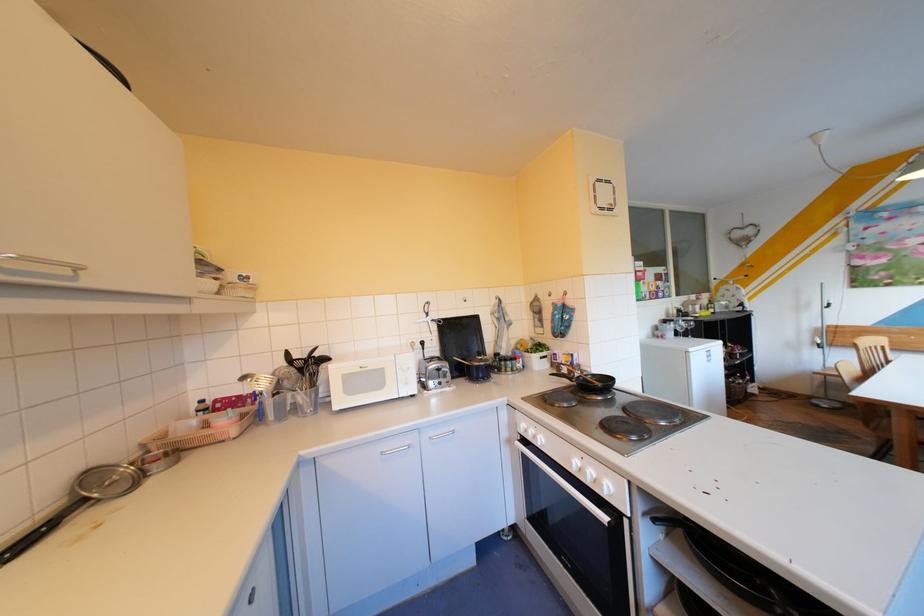
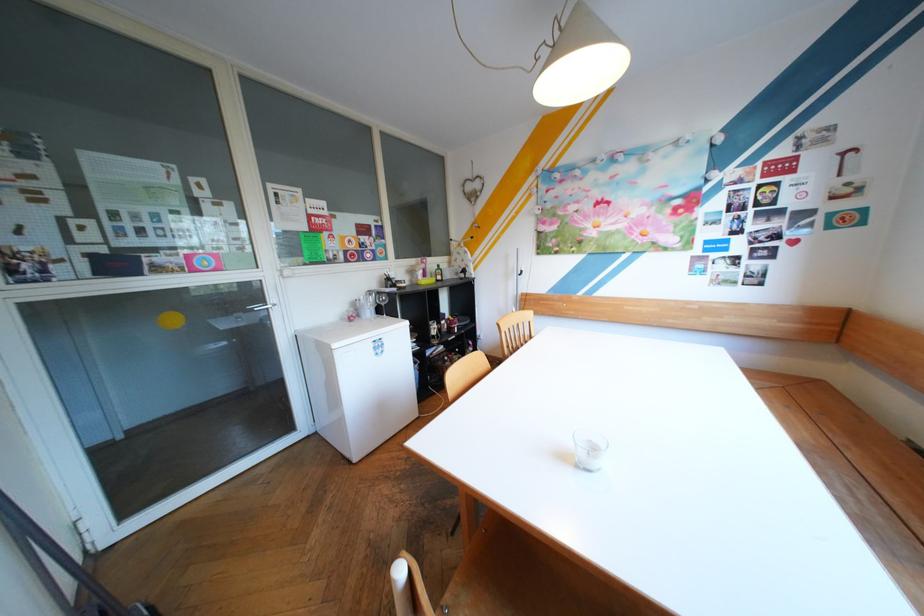
Locate, in the second image, the point that corresponds to (677,320) in the first image.

(383, 292)